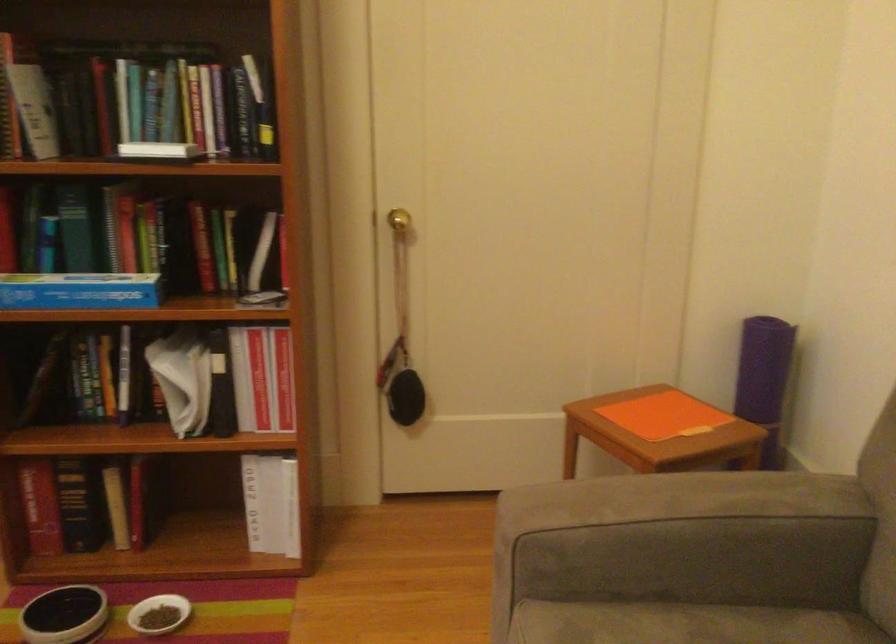
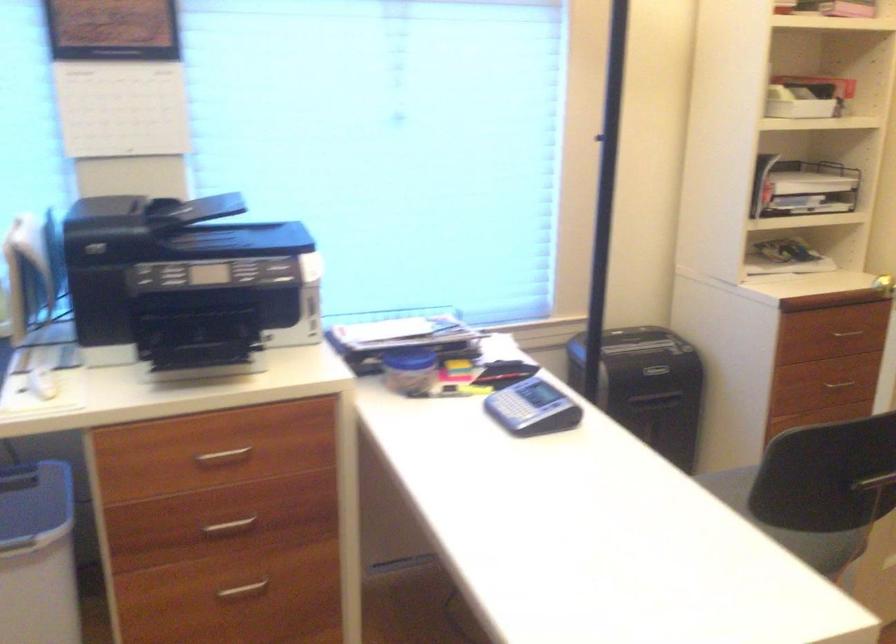
Question: The first image is from the beginning of the video and the second image is from the end. How did the camera likely rotate when shooting the video?

Choices:
 (A) Left
 (B) Right
 (C) Up
 (D) Down

Answer: (A)